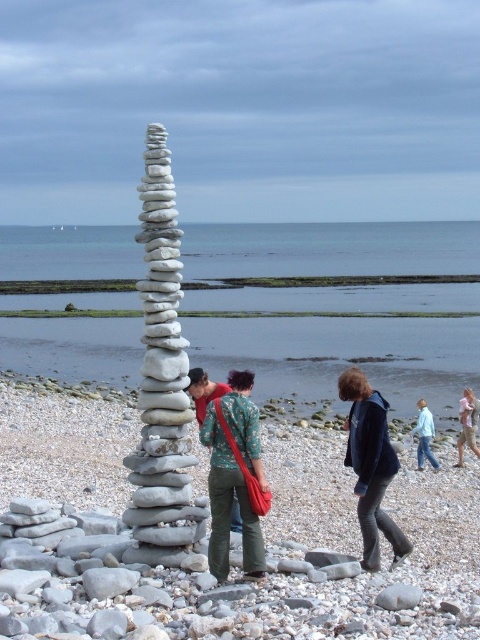
Question: Can you confirm if gray stone stack at center is positioned to the right of smooth sand at center?

Choices:
 (A) no
 (B) yes

Answer: (A)

Question: Can you confirm if gray stone stack at center is positioned to the left of floral fabric shirt at center?

Choices:
 (A) no
 (B) yes

Answer: (A)

Question: Which point is farther from the camera taking this photo?

Choices:
 (A) (142, 552)
 (B) (236, 504)
 (C) (217, 424)
 (D) (345, 458)

Answer: (D)

Question: Among these points, which one is farthest from the camera?

Choices:
 (A) (474, 448)
 (B) (175, 531)
 (C) (296, 486)

Answer: (A)

Question: Is gray stone stack at center to the right of floral fabric shirt at center from the viewer's perspective?

Choices:
 (A) no
 (B) yes

Answer: (B)

Question: Among these points, which one is farthest from the camera?

Choices:
 (A) (220, 547)
 (B) (431, 275)

Answer: (B)